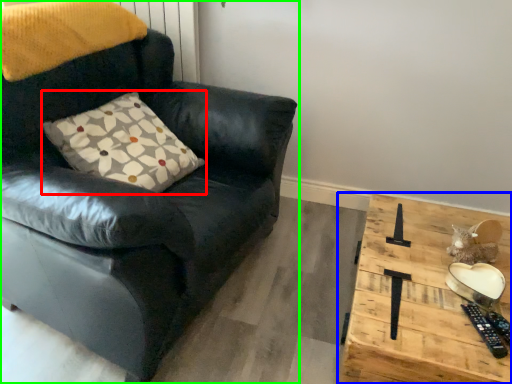
Question: Estimate the real-world distances between objects in this image. Which object is farther from pillow (highlighted by a red box), table (highlighted by a blue box) or chair (highlighted by a green box)?

Choices:
 (A) table
 (B) chair

Answer: (A)